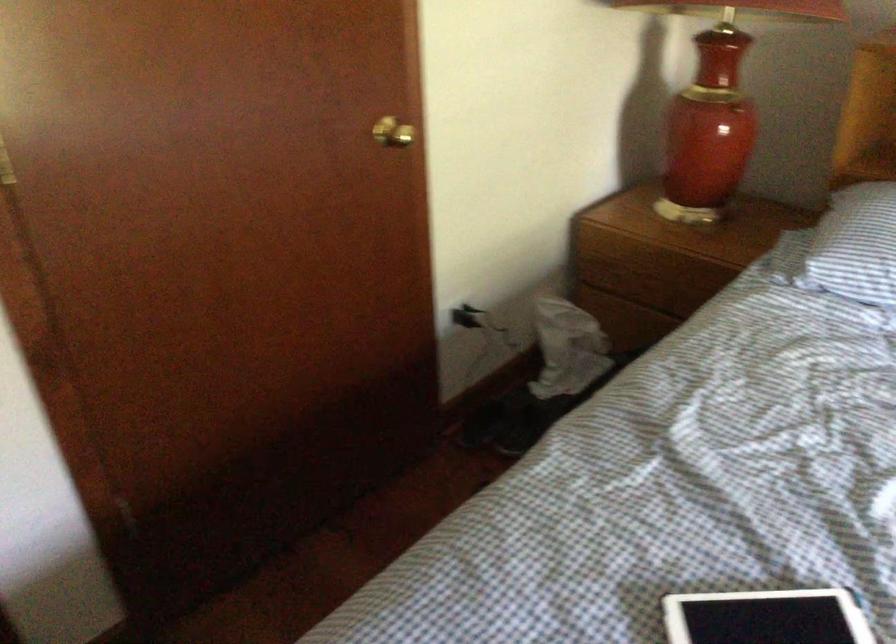
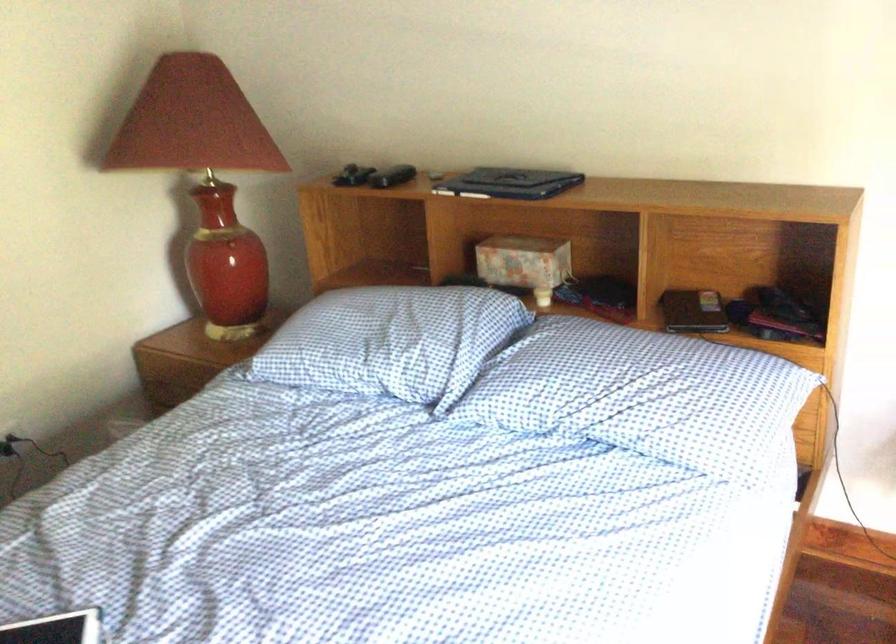
Question: The first image is from the beginning of the video and the second image is from the end. How did the camera likely rotate when shooting the video?

Choices:
 (A) Left
 (B) Right
 (C) Up
 (D) Down

Answer: (B)